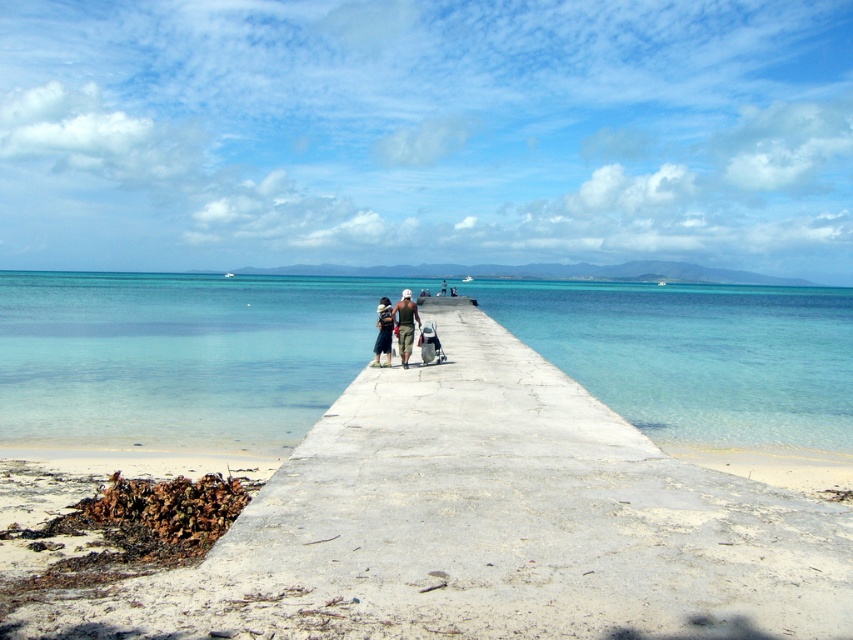
You are standing on the pier and see the concrete at center and the dark green fabric bag at center. Which object is located to the right side from your perspective?

The concrete at center is to the right of the dark green fabric bag at center, so the concrete at center is on the right side.

You are standing on the pier and notice the concrete at center and the matte khaki shorts at center. Which object takes up more space in the image?

The concrete at center is larger in size than the matte khaki shorts at center, so it takes up more space in the image.